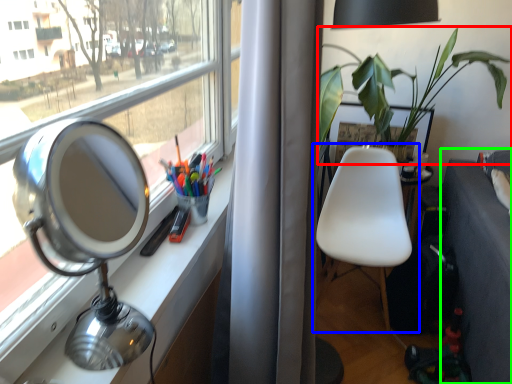
Question: Based on their relative distances, which object is nearer to houseplant (highlighted by a red box)? Choose from chair (highlighted by a blue box) and studio couch (highlighted by a green box).

Choices:
 (A) chair
 (B) studio couch

Answer: (A)